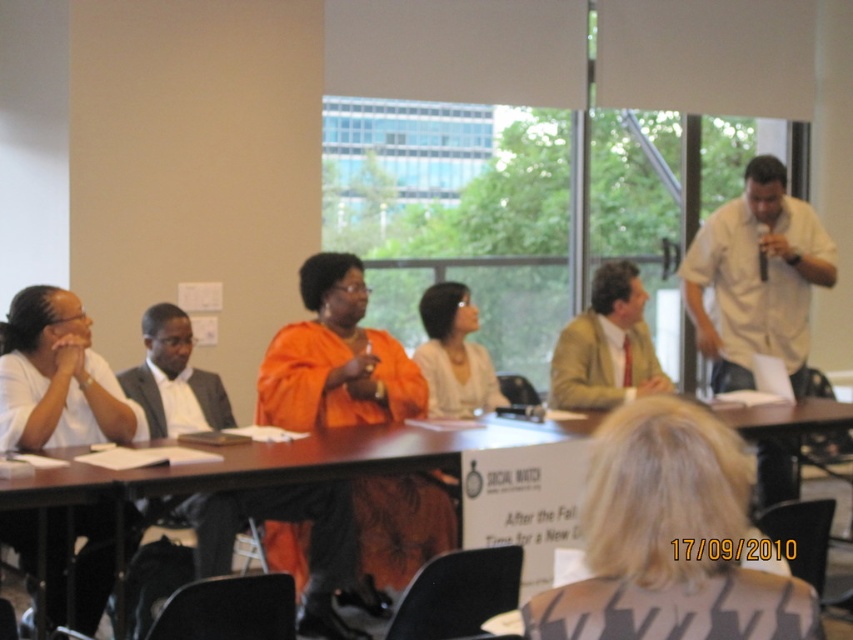
You are organizing a small event and need to place a light brown leather jacket at center on a wooden table at center. Will the jacket fit entirely on the table?

The wooden table at center is wider than the light brown leather jacket at center, so the jacket will fit entirely on the table.

In the conference room scene, you are a meeting organizer who needs to seat two new participants. The first participant prefers a seat with more space, and the second prefers a seat with less space. Given the current seating arrangement with the white shirt at right and light brown leather jacket at center, which seat should each new participant take?

The participant who prefers more space should take the seat at the white shirt at right since its width surpasses the light brown leather jacket at center. The other participant preferring less space should take the seat at the light brown leather jacket at center.